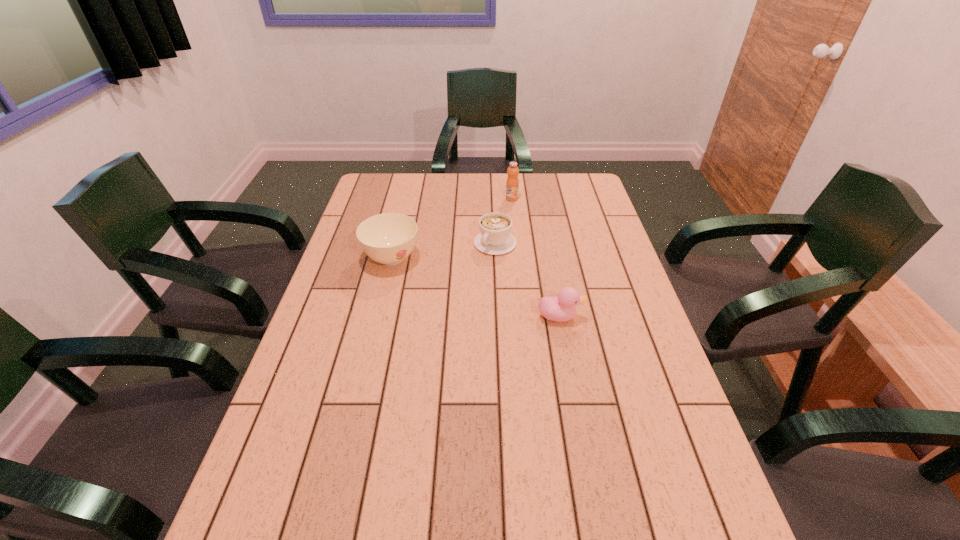
The height and width of the screenshot is (540, 960). Identify the location of free space between the rightmost object and the cappuccino. (527, 280).

The width and height of the screenshot is (960, 540). I want to click on vacant region between the rightmost object and the sugar bowl, so click(475, 288).

Find the location of a particular element. This screenshot has height=540, width=960. free space between the duckling and the leftmost object is located at coordinates (475, 288).

This screenshot has height=540, width=960. Find the location of `empty space that is in between the leftmost object and the farthest object`. empty space that is in between the leftmost object and the farthest object is located at coordinates (452, 229).

The height and width of the screenshot is (540, 960). In order to click on free space between the duckling and the shortest object in this screenshot , I will do `click(527, 280)`.

What are the coordinates of `free spot between the leftmost object and the duckling` in the screenshot? It's located at (475, 288).

Where is `vacant space that's between the shortest object and the nearest object`? This screenshot has width=960, height=540. vacant space that's between the shortest object and the nearest object is located at coordinates (527, 280).

Locate an element on the screen. This screenshot has height=540, width=960. free space between the sugar bowl and the cappuccino is located at coordinates (444, 251).

At what (x,y) coordinates should I click in order to perform the action: click on free space between the sugar bowl and the shortest object. Please return your answer as a coordinate pair (x, y). The height and width of the screenshot is (540, 960). Looking at the image, I should click on (444, 251).

Locate an element on the screen. This screenshot has height=540, width=960. object that is the third closest to the farthest object is located at coordinates (562, 308).